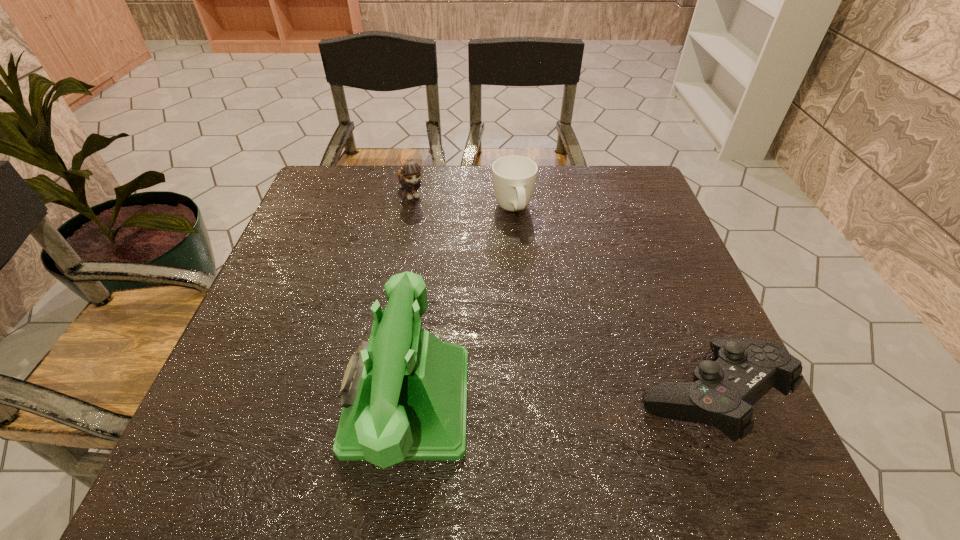
You are a GUI agent. You are given a task and a screenshot of the screen. Output one action in this format:
    pyautogui.click(x=<x>, y=<y>)
    Task: Click on the vacant spot on the desktop that is between the telephone and the rightmost object and is positioned on the front-facing side of the kitten
    This screenshot has width=960, height=540.
    Given the screenshot: What is the action you would take?
    pyautogui.click(x=521, y=400)

Where is `free space on the desktop that is between the tallest object and the control and is positioned with the handle on the side of the second object from right to left`? This screenshot has width=960, height=540. free space on the desktop that is between the tallest object and the control and is positioned with the handle on the side of the second object from right to left is located at coordinates (577, 399).